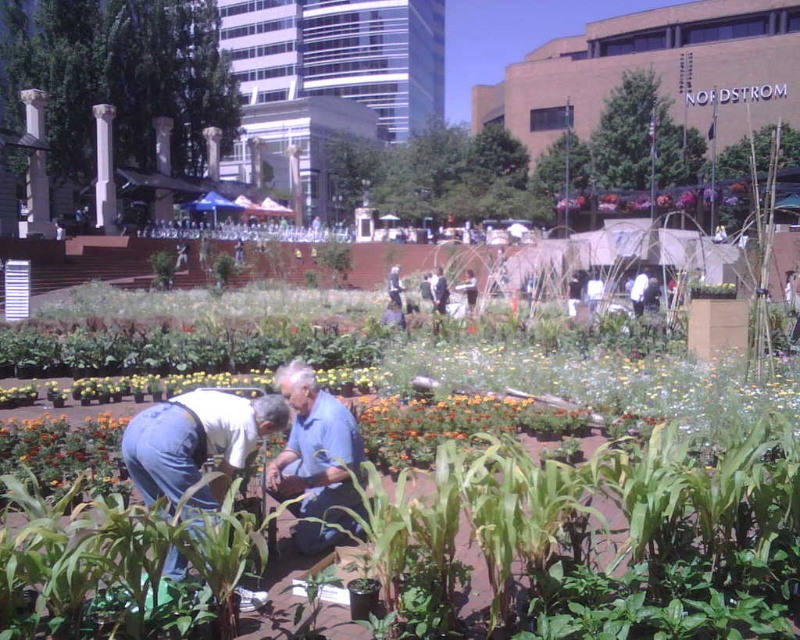
Question: Which point is closer to the camera?

Choices:
 (A) denim jeans at center
 (B) blue jeans at center

Answer: (A)

Question: Estimate the real-world distances between objects in this image. Which object is farther from the blue cotton shirt at center?

Choices:
 (A) white fabric at center
 (B) denim jeans at center
 (C) blue jeans at center

Answer: (C)

Question: In this image, where is white fabric at center located relative to blue jeans at center?

Choices:
 (A) right
 (B) left

Answer: (A)

Question: Which of the following is the closest to the observer?

Choices:
 (A) (176, 497)
 (B) (642, 269)
 (C) (448, 292)
 (D) (274, 490)

Answer: (A)

Question: Does denim jeans at center have a lesser width compared to white fabric at center?

Choices:
 (A) no
 (B) yes

Answer: (A)

Question: Is denim jeans at center to the right of blue cotton shirt at center from the viewer's perspective?

Choices:
 (A) yes
 (B) no

Answer: (B)